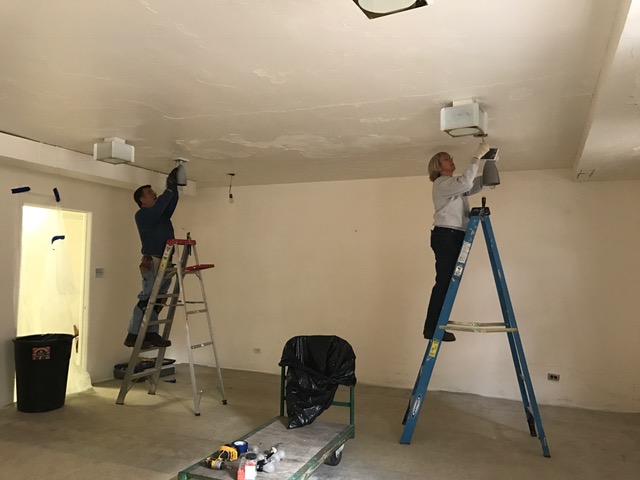
Where is `light switch`? The width and height of the screenshot is (640, 480). light switch is located at coordinates (98, 273).